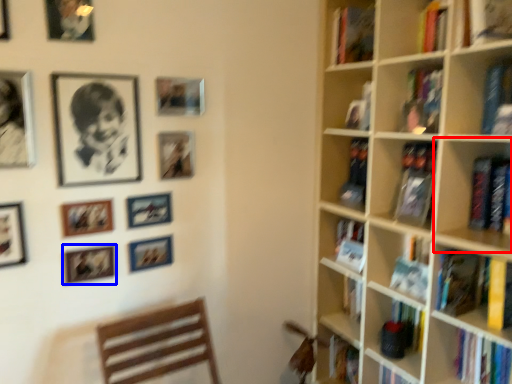
Question: Among these objects, which one is nearest to the camera, shelf (highlighted by a red box) or picture frame (highlighted by a blue box)?

Choices:
 (A) shelf
 (B) picture frame

Answer: (A)